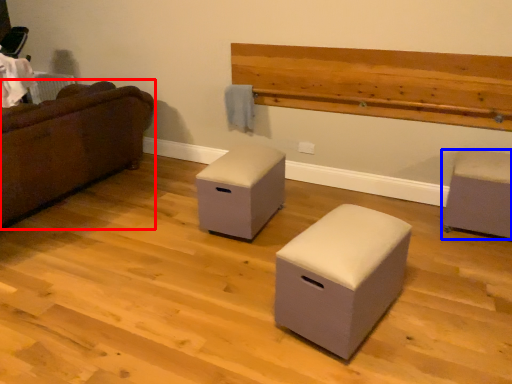
Question: Which object appears closest to the camera in this image, studio couch (highlighted by a red box) or furniture (highlighted by a blue box)?

Choices:
 (A) studio couch
 (B) furniture

Answer: (A)